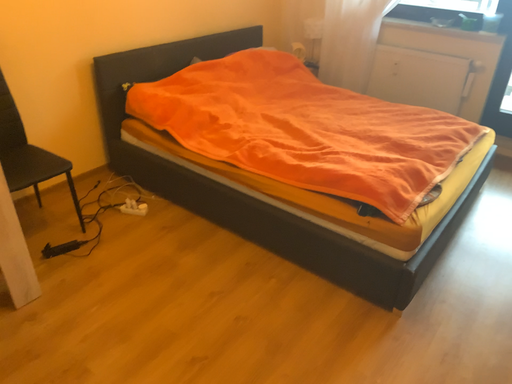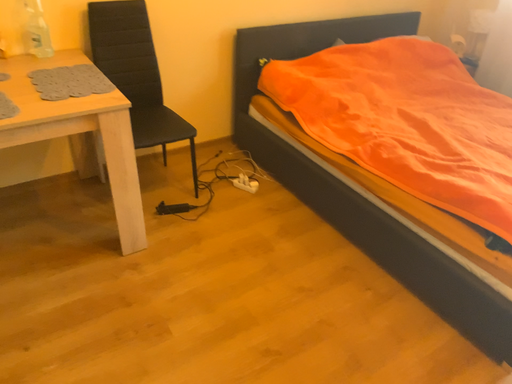
Question: Which way did the camera rotate in the video?

Choices:
 (A) rotated left
 (B) rotated right

Answer: (A)